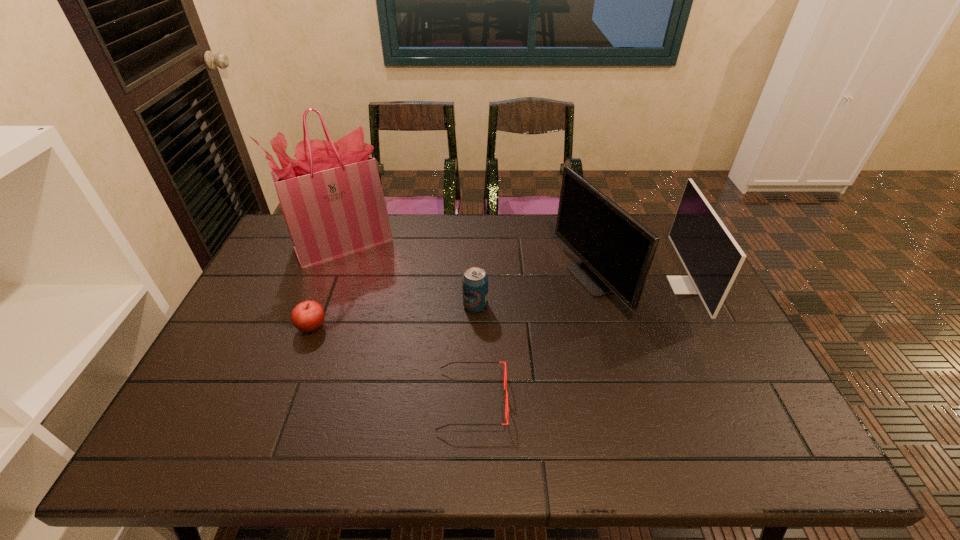
I want to click on vacant area that lies between the third shortest object and the spectacles, so click(x=473, y=353).

This screenshot has width=960, height=540. I want to click on free space between the right monitor and the pop soda, so click(x=580, y=295).

Where is `unoccupied area between the left monitor and the shopping bag`? unoccupied area between the left monitor and the shopping bag is located at coordinates (466, 261).

This screenshot has height=540, width=960. What are the coordinates of `vacant space in between the pop soda and the apple` in the screenshot? It's located at (394, 316).

This screenshot has height=540, width=960. What are the coordinates of `unoccupied area between the shortest object and the tallest object` in the screenshot? It's located at (407, 321).

The width and height of the screenshot is (960, 540). Identify the location of free space between the apple and the shopping bag. (327, 285).

Select which object is the third closest to the nearest object. Please provide its 2D coordinates. Your answer should be formatted as a tuple, i.e. [(x, y)], where the tuple contains the x and y coordinates of a point satisfying the conditions above.

[(307, 316)]

The height and width of the screenshot is (540, 960). I want to click on object that ranks as the fifth closest to the left monitor, so pyautogui.click(x=307, y=316).

Image resolution: width=960 pixels, height=540 pixels. What are the coordinates of `vacant space that satisfies the following two spatial constraints: 1. on the front-facing side of the right monitor; 2. on the front side of the apple` in the screenshot? It's located at pos(706,327).